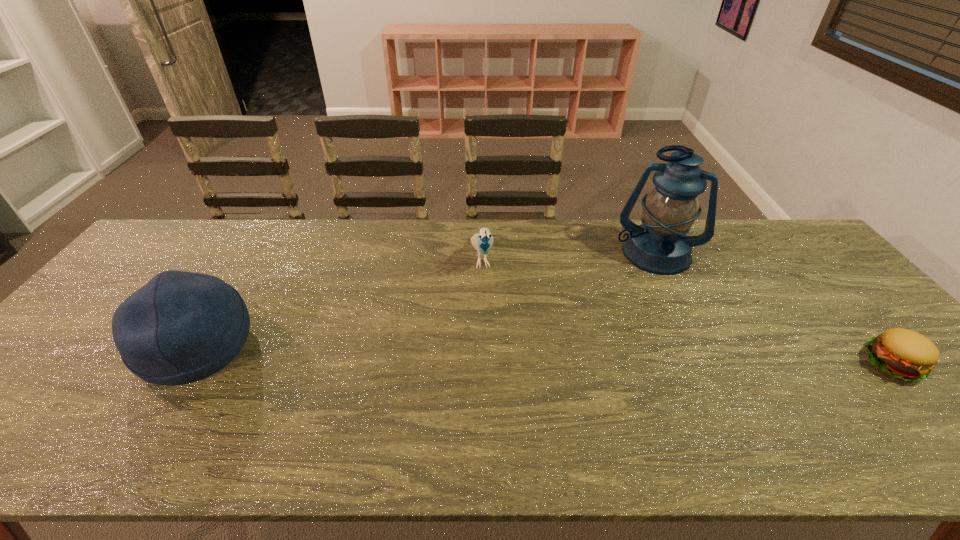
The image size is (960, 540). I want to click on free space located at the face of the third object from right to left, so click(x=498, y=371).

Locate an element on the screen. vacant space located at the face of the third object from right to left is located at coordinates click(x=487, y=302).

Locate an element on the screen. This screenshot has width=960, height=540. vacant space located at the face of the third object from right to left is located at coordinates (500, 382).

I want to click on vacant region located 0.050m on the face of the third object from left to right, so click(x=643, y=284).

This screenshot has height=540, width=960. In order to click on vacant point located 0.260m on the face of the third object from left to right in this screenshot , I will do `click(633, 333)`.

The image size is (960, 540). Identify the location of vacant area located on the face of the third object from left to right. (628, 355).

Find the location of `bird located in the far edge section of the desktop`. bird located in the far edge section of the desktop is located at coordinates (482, 242).

Where is `lantern present at the far edge`? lantern present at the far edge is located at coordinates (659, 245).

Identify the location of skullcap that is at the near edge. (181, 327).

Identify the location of hamburger situated at the near edge. [903, 354].